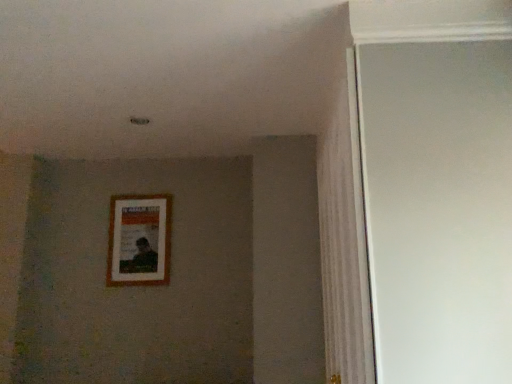
Question: From a real-world perspective, is white glossy door at right positioned above or below wooden picture frame at center?

Choices:
 (A) above
 (B) below

Answer: (B)

Question: Is white glossy door at right in front of or behind wooden picture frame at center in the image?

Choices:
 (A) front
 (B) behind

Answer: (A)

Question: In terms of size, does white glossy door at right appear bigger or smaller than wooden picture frame at center?

Choices:
 (A) small
 (B) big

Answer: (B)

Question: Would you say wooden picture frame at center is inside or outside white glossy door at right?

Choices:
 (A) outside
 (B) inside

Answer: (A)

Question: Visually, is wooden picture frame at center positioned to the left or to the right of white glossy door at right?

Choices:
 (A) left
 (B) right

Answer: (A)

Question: In terms of size, does wooden picture frame at center appear bigger or smaller than white glossy door at right?

Choices:
 (A) big
 (B) small

Answer: (B)

Question: From the image's perspective, is wooden picture frame at center above or below white glossy door at right?

Choices:
 (A) above
 (B) below

Answer: (B)